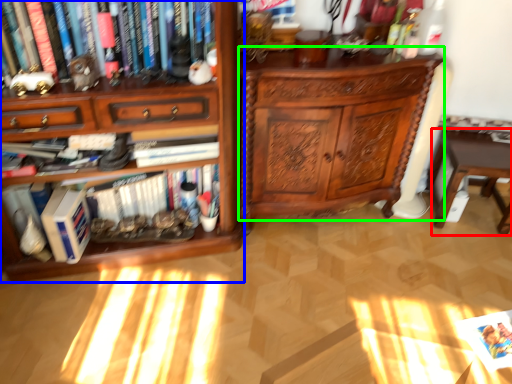
Question: Which object is positioned closest to table (highlighted by a red box)? Select from bookcase (highlighted by a blue box) and chest of drawers (highlighted by a green box).

Choices:
 (A) bookcase
 (B) chest of drawers

Answer: (B)